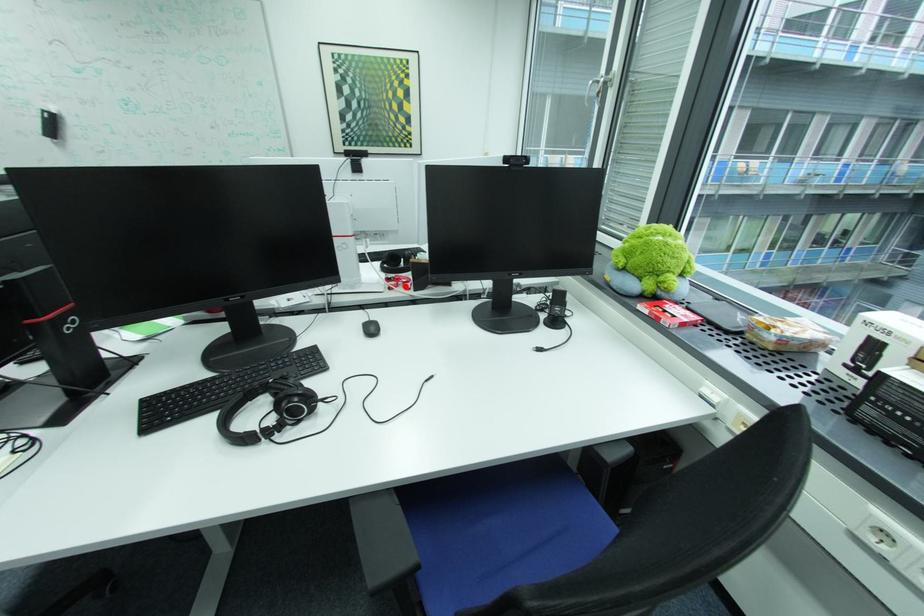
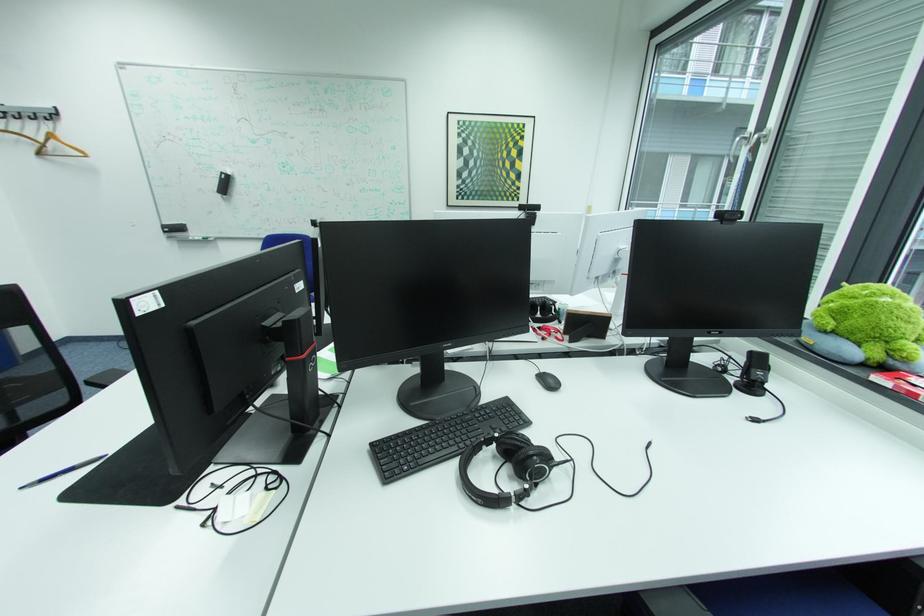
Where in the second image is the point corresponding to the highlighted location from the first image?

(558, 337)